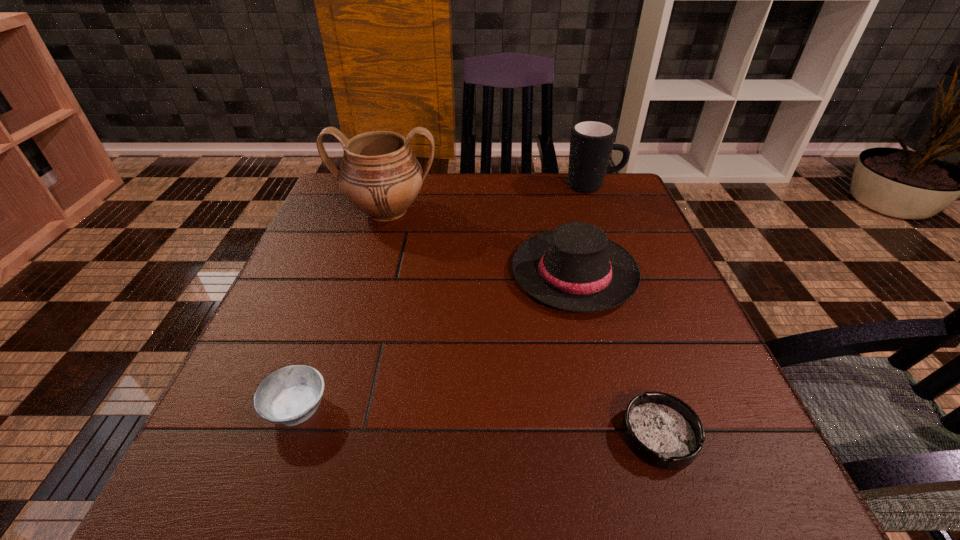
The image size is (960, 540). What are the coordinates of `vacant space that satisfies the following two spatial constraints: 1. on the front side of the dress hat; 2. on the right side of the shorter ashtray` in the screenshot? It's located at (614, 435).

What are the coordinates of `vacant area in the image that satisfies the following two spatial constraints: 1. on the front-facing side of the tallest object; 2. on the right side of the third nearest object` in the screenshot? It's located at (369, 273).

Where is `vacant space that satisfies the following two spatial constraints: 1. on the side of the fourth shortest object with the handle; 2. on the front side of the right ashtray`? The height and width of the screenshot is (540, 960). vacant space that satisfies the following two spatial constraints: 1. on the side of the fourth shortest object with the handle; 2. on the front side of the right ashtray is located at coordinates (689, 435).